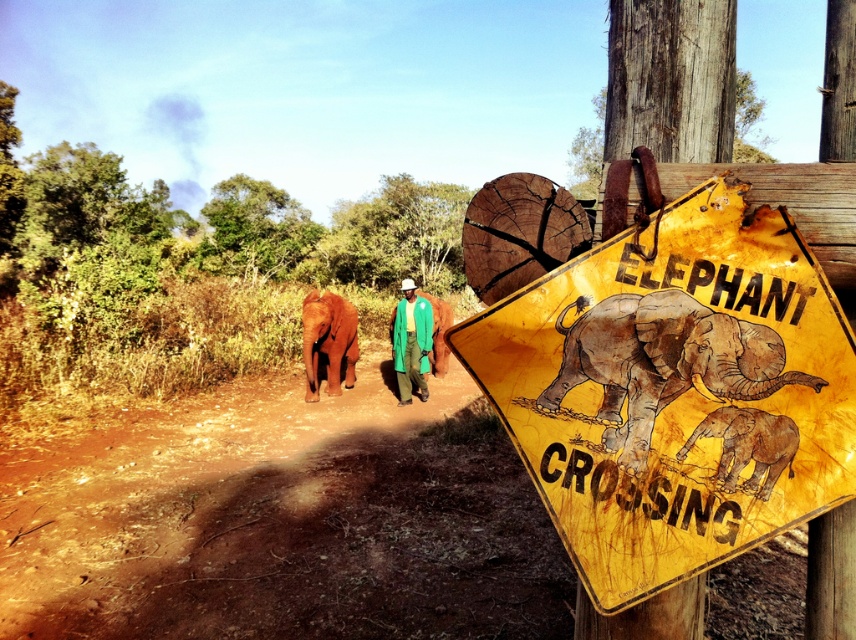
Question: Which point is closer to the camera?

Choices:
 (A) green fabric jacket at center
 (B) orange smooth elephant at lower left
 (C) yellow rusted metal sign at upper right

Answer: (C)

Question: Is brown textured baby elephant at lower right smaller than green fabric jacket at center?

Choices:
 (A) yes
 (B) no

Answer: (A)

Question: Which of the following is the closest to the observer?

Choices:
 (A) (767, 356)
 (B) (408, 369)

Answer: (A)

Question: Does yellow rusted metal sign at upper right lie in front of rusty metal elephant at center?

Choices:
 (A) yes
 (B) no

Answer: (A)

Question: Which object appears closest to the camera in this image?

Choices:
 (A) yellow rusted metal sign at upper right
 (B) rusty metal elephant at center
 (C) orange smooth elephant at lower left
 (D) green fabric jacket at center

Answer: (A)

Question: Can you confirm if rusty metal elephant at center is wider than brown textured baby elephant at lower right?

Choices:
 (A) yes
 (B) no

Answer: (A)